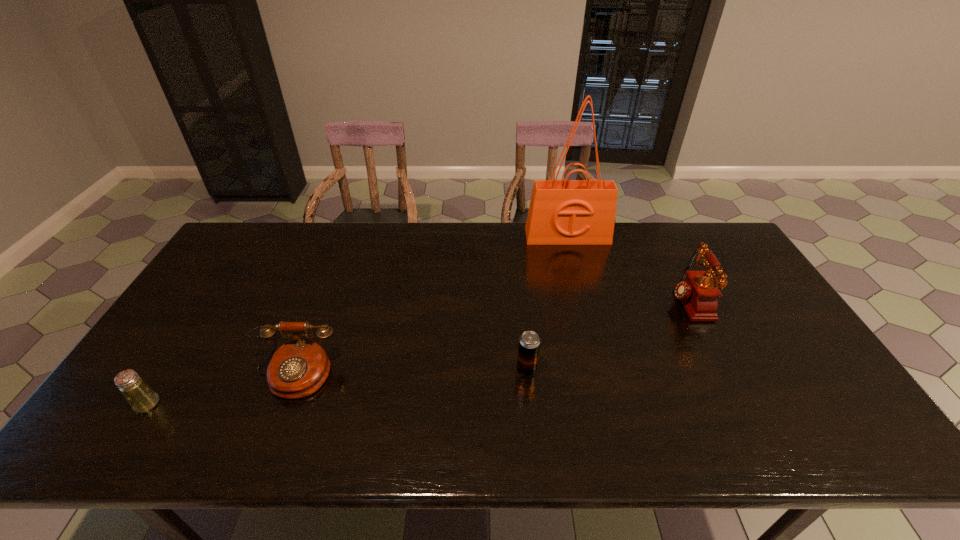
Locate an element on the screen. tote bag is located at coordinates (562, 212).

The height and width of the screenshot is (540, 960). I want to click on the farthest object, so click(562, 212).

Locate an element on the screen. the right telephone is located at coordinates (698, 293).

In order to click on the fourth nearest object in this screenshot , I will do `click(698, 293)`.

This screenshot has width=960, height=540. I want to click on the fourth object from right to left, so click(297, 369).

At what (x,y) coordinates should I click in order to perform the action: click on the shorter telephone. Please return your answer as a coordinate pair (x, y). Looking at the image, I should click on (297, 369).

The image size is (960, 540). What are the coordinates of `the third object from right to left` in the screenshot? It's located at (529, 342).

Where is `saltshaker`? saltshaker is located at coordinates (140, 396).

This screenshot has width=960, height=540. Identify the location of vacant region located 0.050m on the logo side of the second object from right to left. (572, 254).

Locate an element on the screen. vacant space located 0.390m on the dial of the right telephone is located at coordinates tap(540, 300).